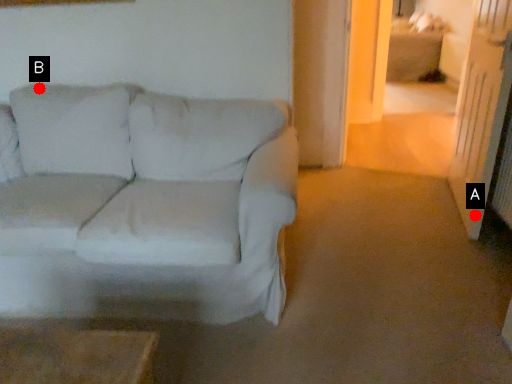
Question: Two points are circled on the image, labeled by A and B beside each circle. Which point is closer to the camera?

Choices:
 (A) A is closer
 (B) B is closer

Answer: (B)